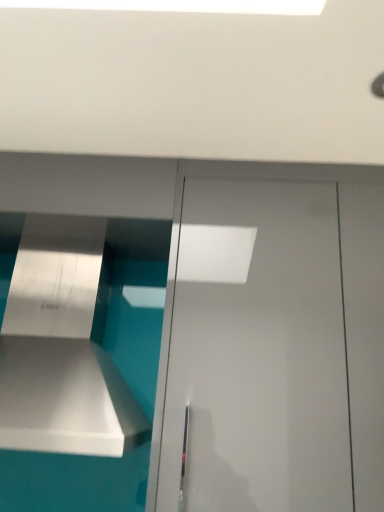
This screenshot has height=512, width=384. Find the location of `white glossy door at center`. white glossy door at center is located at coordinates (257, 352).

This screenshot has height=512, width=384. What do you see at coordinates (257, 352) in the screenshot? I see `white glossy door at center` at bounding box center [257, 352].

The height and width of the screenshot is (512, 384). What do you see at coordinates (61, 348) in the screenshot?
I see `metallic silver vent at left` at bounding box center [61, 348].

At what (x,y) coordinates should I click in order to perform the action: click on metallic silver vent at left. Please return your answer as a coordinate pair (x, y). Image resolution: width=384 pixels, height=512 pixels. Looking at the image, I should click on (61, 348).

Locate an element on the screen. The image size is (384, 512). white glossy door at center is located at coordinates (257, 352).

Is metallic silver vent at left at the right side of white glossy door at center?

In fact, metallic silver vent at left is to the left of white glossy door at center.

Does metallic silver vent at left lie behind white glossy door at center?

No, metallic silver vent at left is closer to the viewer.

Is point (57, 237) closer or farther from the camera than point (280, 494)?

Point (57, 237).

From the image's perspective, which one is positioned higher, metallic silver vent at left or white glossy door at center?

From the image's view, metallic silver vent at left is above.

From a real-world perspective, which is physically below, metallic silver vent at left or white glossy door at center?

In real-world perspective, metallic silver vent at left is lower.

Between metallic silver vent at left and white glossy door at center, which one has larger width?

With larger width is metallic silver vent at left.

In terms of height, does metallic silver vent at left look taller or shorter compared to white glossy door at center?

Clearly, metallic silver vent at left is shorter compared to white glossy door at center.

Considering the sizes of objects metallic silver vent at left and white glossy door at center in the image provided, who is smaller, metallic silver vent at left or white glossy door at center?

metallic silver vent at left is smaller.

Looking at this image, choose the correct answer: Is metallic silver vent at left inside white glossy door at center or outside it?

metallic silver vent at left lies outside white glossy door at center.

Is the surface of metallic silver vent at left in direct contact with white glossy door at center?

No, metallic silver vent at left is not next to white glossy door at center.

Is metallic silver vent at left facing away from white glossy door at center?

metallic silver vent at left does not have its back to white glossy door at center.

You are a GUI agent. You are given a task and a screenshot of the screen. Output one action in this format:
    pyautogui.click(x=<x>, y=<y>)
    Task: Click on the door on the right of the metallic silver vent at left
    Image resolution: width=384 pixels, height=512 pixels.
    Given the screenshot: What is the action you would take?
    pyautogui.click(x=257, y=352)

Considering the positions of objects white glossy door at center and metallic silver vent at left in the image provided, who is more to the left, white glossy door at center or metallic silver vent at left?

Positioned to the left is metallic silver vent at left.

Considering their positions, is white glossy door at center located in front of or behind metallic silver vent at left?

In the image, white glossy door at center appears behind metallic silver vent at left.

Which is closer, (x=265, y=368) or (x=87, y=335)?

Point (x=265, y=368) appears to be closer to the viewer than point (x=87, y=335).

From the image's perspective, which is below, white glossy door at center or metallic silver vent at left?

white glossy door at center.

From a real-world perspective, is white glossy door at center positioned over metallic silver vent at left based on gravity?

Indeed, from a real-world perspective, white glossy door at center stands above metallic silver vent at left.

Is white glossy door at center wider than metallic silver vent at left?

Incorrect, the width of white glossy door at center does not surpass that of metallic silver vent at left.

Is white glossy door at center shorter than metallic silver vent at left?

In fact, white glossy door at center may be taller than metallic silver vent at left.

Does white glossy door at center have a larger size compared to metallic silver vent at left?

Correct, white glossy door at center is larger in size than metallic silver vent at left.

Can we say white glossy door at center lies outside metallic silver vent at left?

Indeed, white glossy door at center is completely outside metallic silver vent at left.

Are white glossy door at center and metallic silver vent at left far apart?

They are positioned close to each other.

Does white glossy door at center turn towards metallic silver vent at left?

No, white glossy door at center is not turned towards metallic silver vent at left.

This screenshot has width=384, height=512. What are the coordinates of `vent that is on the left side of white glossy door at center` in the screenshot? It's located at (61, 348).

At what (x,y) coordinates should I click in order to perform the action: click on door to the right of metallic silver vent at left. Please return your answer as a coordinate pair (x, y). The height and width of the screenshot is (512, 384). Looking at the image, I should click on [x=257, y=352].

Identify the location of vent below the white glossy door at center (from a real-world perspective). The image size is (384, 512). (61, 348).